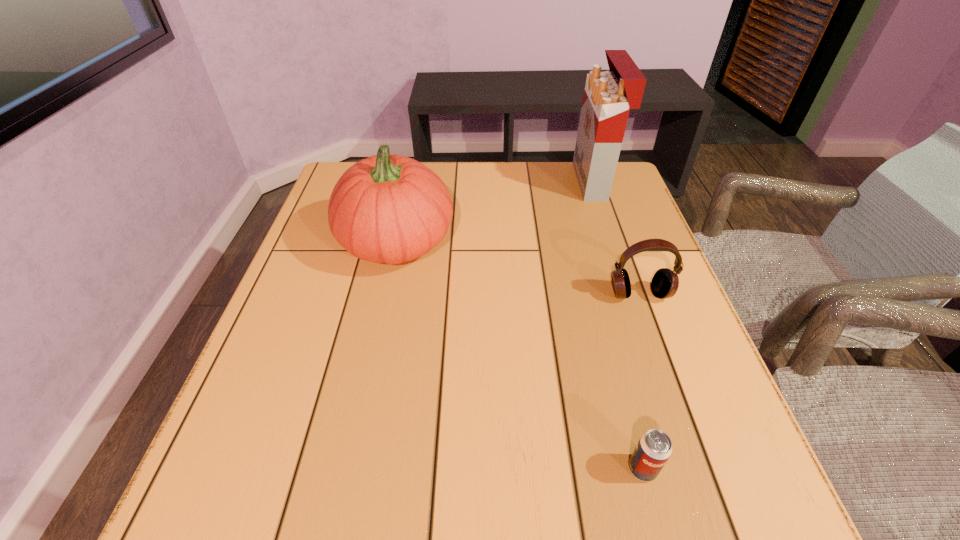
This screenshot has height=540, width=960. Find the location of `vacant space that satisfies the following two spatial constraints: 1. with the lid open on the cigarette case; 2. on the front side of the shortest object`. vacant space that satisfies the following two spatial constraints: 1. with the lid open on the cigarette case; 2. on the front side of the shortest object is located at coordinates (691, 469).